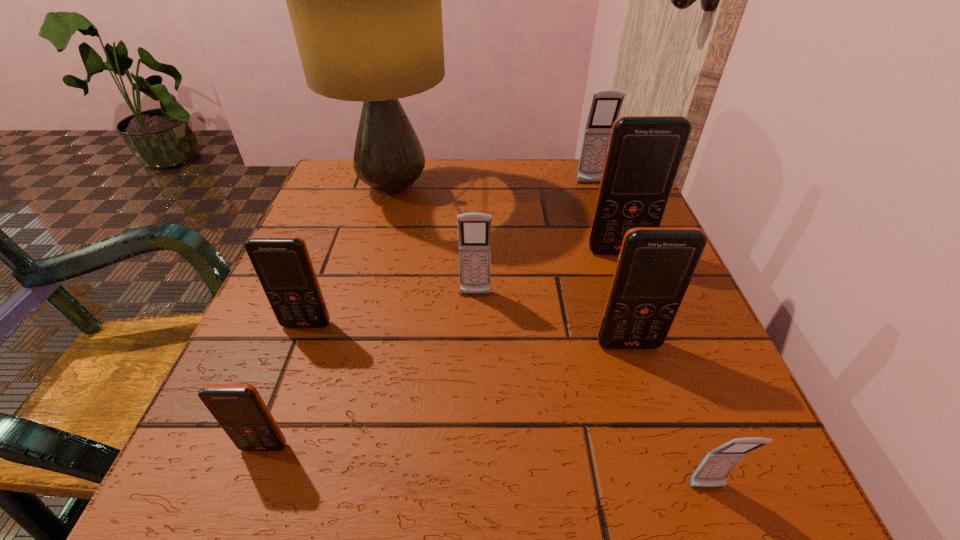
In the image, there is a desktop. Identify the location of vacant space at the far edge. (558, 187).

This screenshot has height=540, width=960. In order to click on vacant area at the near edge of the desktop in this screenshot , I will do `click(516, 482)`.

Identify the location of free space at the left edge of the desktop. Image resolution: width=960 pixels, height=540 pixels. (308, 428).

The height and width of the screenshot is (540, 960). I want to click on vacant space at the right edge of the desktop, so click(x=749, y=425).

Where is `free location at the far left corner`? free location at the far left corner is located at coordinates (327, 211).

Locate an element on the screen. This screenshot has height=540, width=960. vacant region at the near left corner of the desktop is located at coordinates [x=311, y=487].

Locate an element on the screen. This screenshot has height=540, width=960. vacant space at the far right corner is located at coordinates (570, 179).

This screenshot has width=960, height=540. Identify the location of empty space that is in between the seventh farthest object and the third biggest orange cellular telephone. (285, 386).

Find the location of a particular element. This screenshot has height=540, width=960. empty space between the second nearest cellular telephone and the tallest cellular telephone is located at coordinates (442, 349).

What are the coordinates of `vacant point located between the fifth farthest cellular telephone and the fourth nearest object` in the screenshot? It's located at (468, 334).